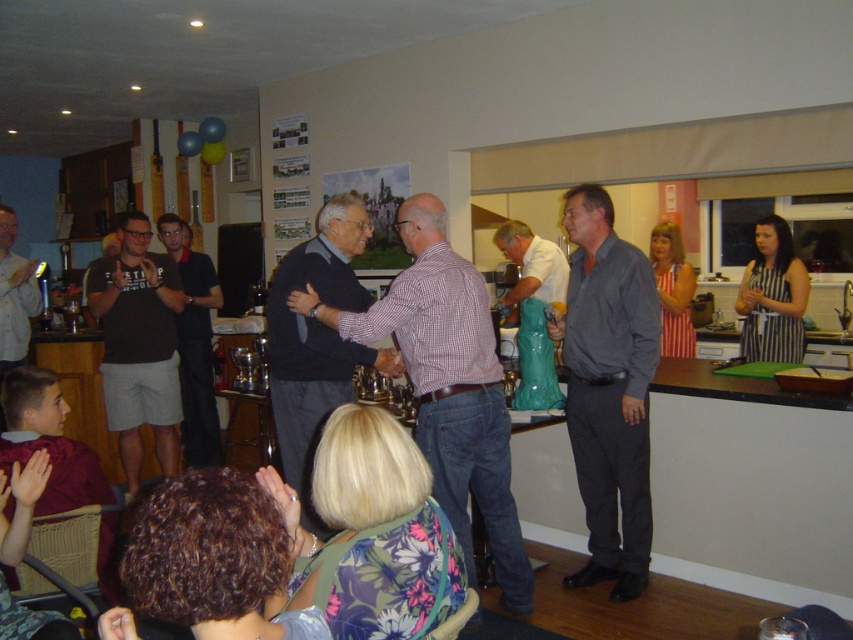
Which is below, dark gray sweater at center or matte green vase at center?

dark gray sweater at center is below.

Does point (305, 252) come farther from viewer compared to point (498, 236)?

No, (305, 252) is in front of (498, 236).

Which is behind, point (314, 524) or point (560, 285)?

The point (560, 285) is behind.

What are the coordinates of `dark gray sweater at center` in the screenshot? It's located at (317, 342).

Between checkered fabric shirt at center and dark gray sweater at center, which one has less height?

dark gray sweater at center is shorter.

Is checkered fabric shirt at center below dark gray sweater at center?

Yes.

At what (x,y) coordinates should I click in order to perform the action: click on checkered fabric shirt at center. Please return your answer as a coordinate pair (x, y). Looking at the image, I should click on (448, 385).

Identify the location of checkered fabric shirt at center. The width and height of the screenshot is (853, 640). (448, 385).

Is checkered fabric shirt at center below black cotton t-shirt at center?

Yes.

Identify the location of checkered fabric shirt at center. (448, 385).